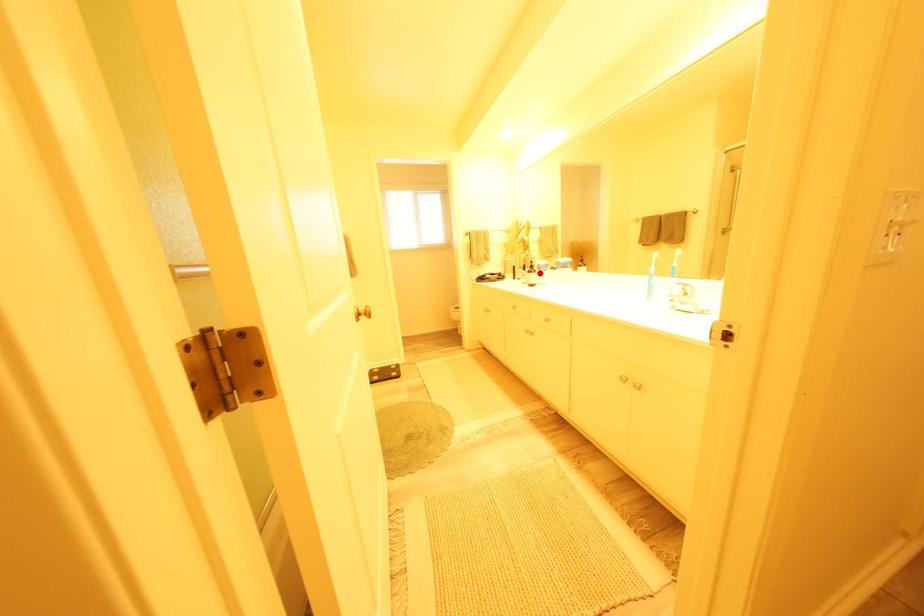
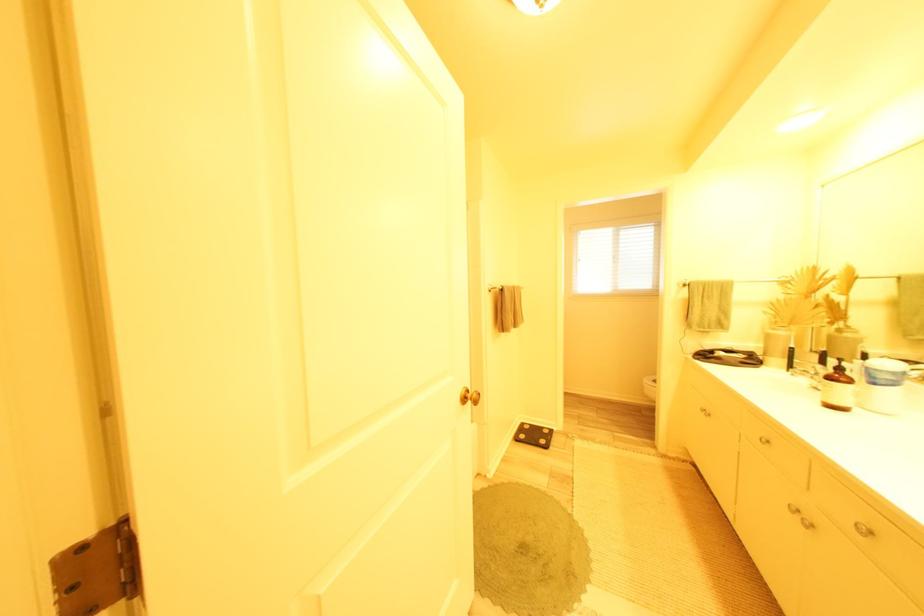
Question: I am providing you with two images of the same scene from different viewpoints. A red point is shown in image1. For the corresponding object point in image2, is it positioned nearer or farther from the camera?

Choices:
 (A) Nearer
 (B) Farther

Answer: (B)